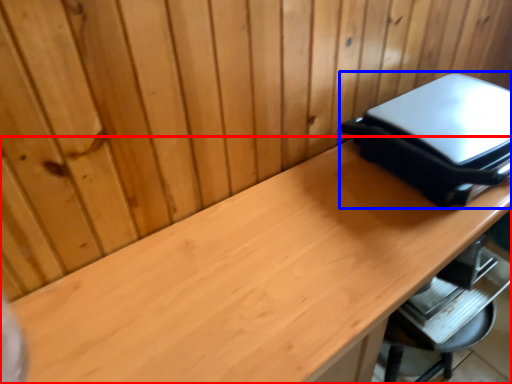
Question: Which object appears farthest to the camera in this image, desk (highlighted by a red box) or appliance (highlighted by a blue box)?

Choices:
 (A) desk
 (B) appliance

Answer: (B)